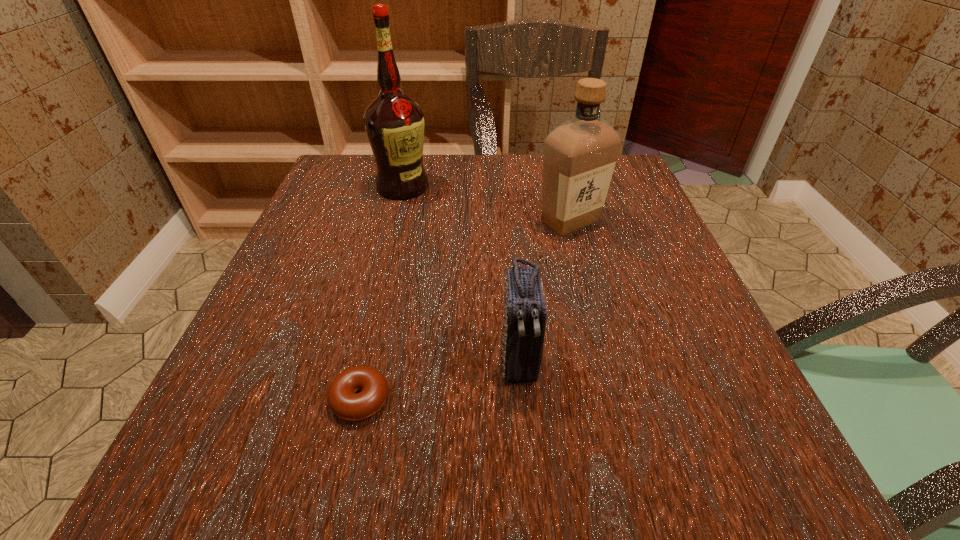
Locate an element on the screen. The image size is (960, 540). vacant space in between the tallest object and the third nearest object is located at coordinates (487, 204).

At what (x,y) coordinates should I click in order to perform the action: click on free space between the doughnut and the rightmost object. Please return your answer as a coordinate pair (x, y). The height and width of the screenshot is (540, 960). Looking at the image, I should click on (466, 310).

Locate an element on the screen. This screenshot has width=960, height=540. empty space between the second farthest object and the shortest object is located at coordinates (466, 310).

Identify the location of the third closest object to the second farthest object. This screenshot has height=540, width=960. (343, 400).

Locate an element on the screen. This screenshot has width=960, height=540. object that is the nearest to the third nearest object is located at coordinates (394, 123).

Identify the location of free space that satisfies the following two spatial constraints: 1. on the label of the alcohol; 2. on the right side of the doughnut. The height and width of the screenshot is (540, 960). (349, 399).

This screenshot has width=960, height=540. Identify the location of vacant area that satisfies the following two spatial constraints: 1. on the label of the doughnut; 2. on the right side of the alcohol. (349, 399).